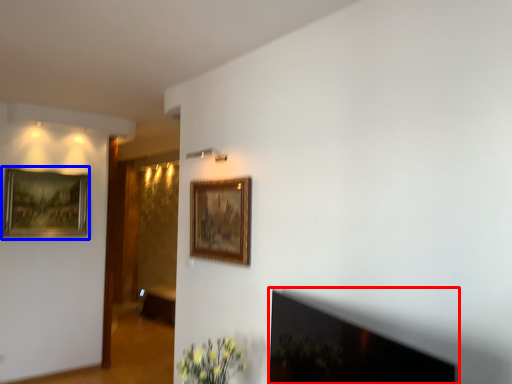
Question: Among these objects, which one is nearest to the camera, fireplace (highlighted by a red box) or picture frame (highlighted by a blue box)?

Choices:
 (A) fireplace
 (B) picture frame

Answer: (A)